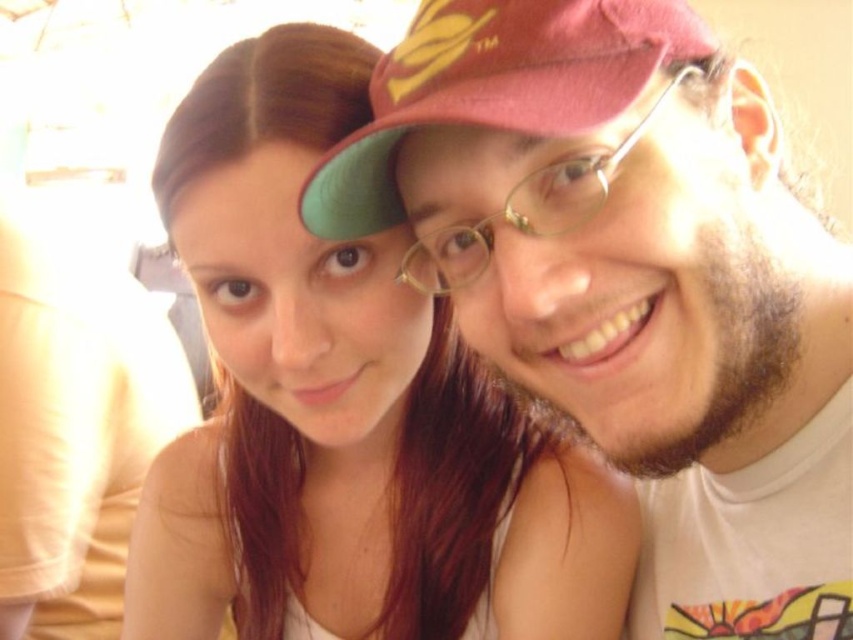
Is the position of matte skin at center less distant than that of matte red cap at upper center?

No, matte skin at center is further to the viewer.

Which is in front, point (282, 131) or point (531, 32)?

Positioned in front is point (531, 32).

What do you see at coordinates (344, 410) in the screenshot? Image resolution: width=853 pixels, height=640 pixels. I see `matte skin at center` at bounding box center [344, 410].

Locate an element on the screen. matte skin at center is located at coordinates (344, 410).

Which of these two, matte white t-shirt at center or matte skin at center, stands shorter?

Standing shorter between the two is matte white t-shirt at center.

Who is more forward, (752, 188) or (177, 188)?

Positioned in front is point (752, 188).

Where is `matte white t-shirt at center`? Image resolution: width=853 pixels, height=640 pixels. matte white t-shirt at center is located at coordinates (631, 284).

Which is behind, point (434, 131) or point (634, 26)?

The point (434, 131) is behind.

Image resolution: width=853 pixels, height=640 pixels. What do you see at coordinates (631, 284) in the screenshot? I see `matte white t-shirt at center` at bounding box center [631, 284].

Locate an element on the screen. Image resolution: width=853 pixels, height=640 pixels. matte white t-shirt at center is located at coordinates (631, 284).